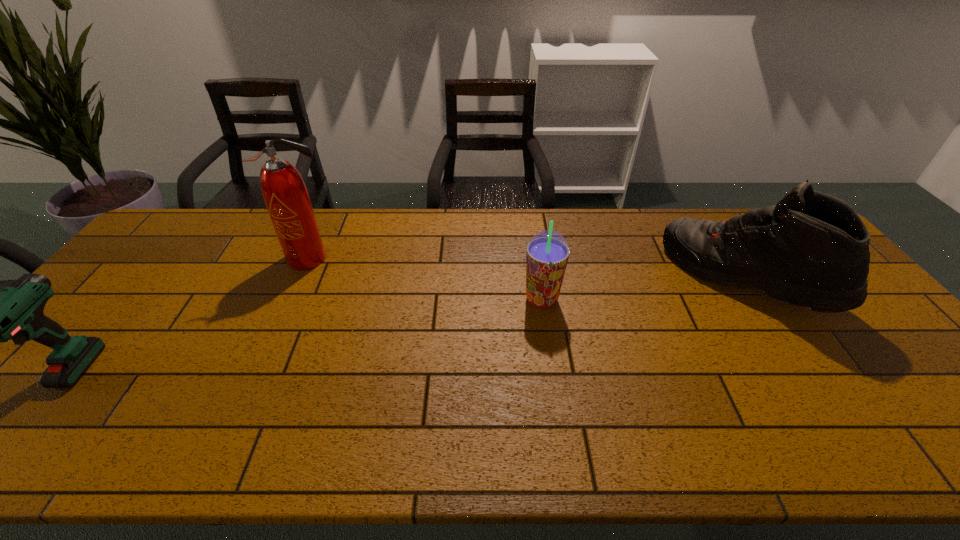
The width and height of the screenshot is (960, 540). I want to click on object that is at the right edge, so click(812, 249).

You are a GUI agent. You are given a task and a screenshot of the screen. Output one action in this format:
    pyautogui.click(x=<x>, y=<y>)
    Task: Click on the object that is at the far right corner
    
    Given the screenshot: What is the action you would take?
    pyautogui.click(x=812, y=249)

The image size is (960, 540). I want to click on vacant space at the far edge of the desktop, so click(516, 248).

You are a GUI agent. You are given a task and a screenshot of the screen. Output one action in this format:
    pyautogui.click(x=<x>, y=<y>)
    Task: Click on the blank space at the near edge of the desktop
    This screenshot has height=540, width=960.
    Given the screenshot: What is the action you would take?
    pyautogui.click(x=237, y=457)

Image resolution: width=960 pixels, height=540 pixels. In the image, there is a desktop. Identify the location of vacant region at the left edge. (118, 314).

This screenshot has height=540, width=960. In the image, there is a desktop. What are the coordinates of `free space at the right edge` in the screenshot? It's located at (853, 321).

Where is `free space at the near left corner of the desktop`? The height and width of the screenshot is (540, 960). free space at the near left corner of the desktop is located at coordinates (21, 431).

In the image, there is a desktop. Where is `vacant space at the near right corner`? vacant space at the near right corner is located at coordinates (948, 424).

Locate an element on the screen. This screenshot has width=960, height=540. free spot between the third shortest object and the third object from left to right is located at coordinates (643, 288).

Locate an element on the screen. The image size is (960, 540). vacant area that lies between the tallest object and the smoothie is located at coordinates tap(425, 279).